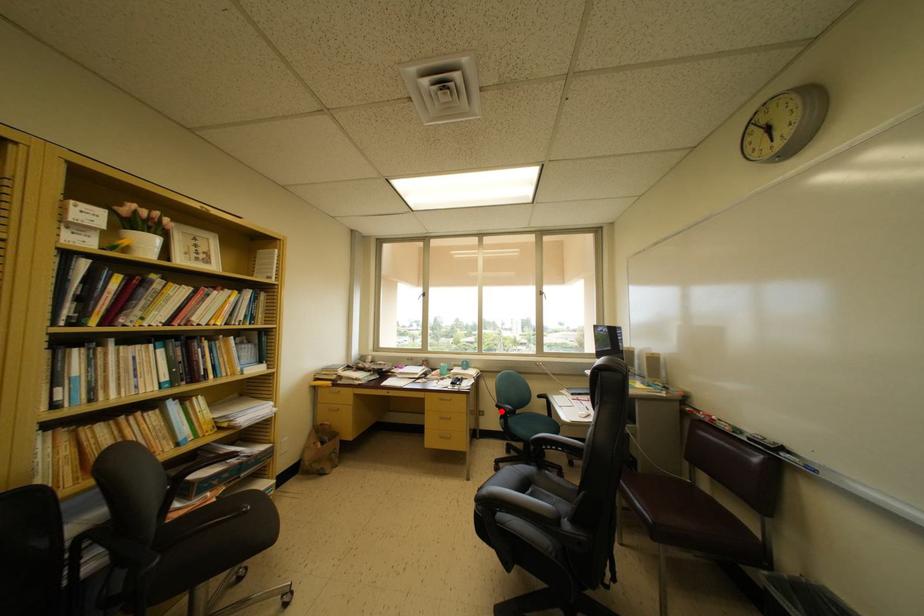
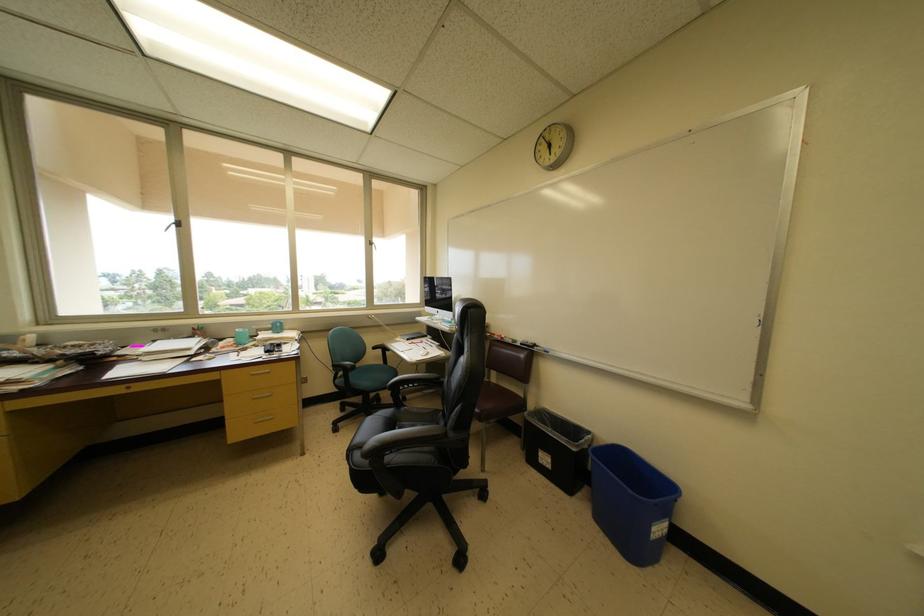
Question: I am providing you with two images of the same scene from different viewpoints. Given a red point in image1, look at the same physical point in image2. Is it:

Choices:
 (A) Closer to the viewpoint
 (B) Farther from the viewpoint

Answer: (A)